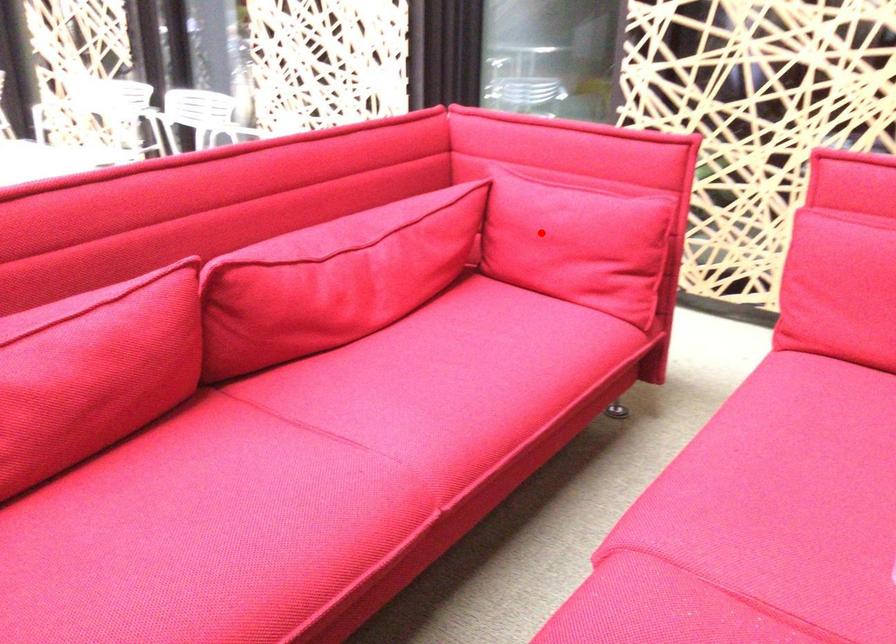
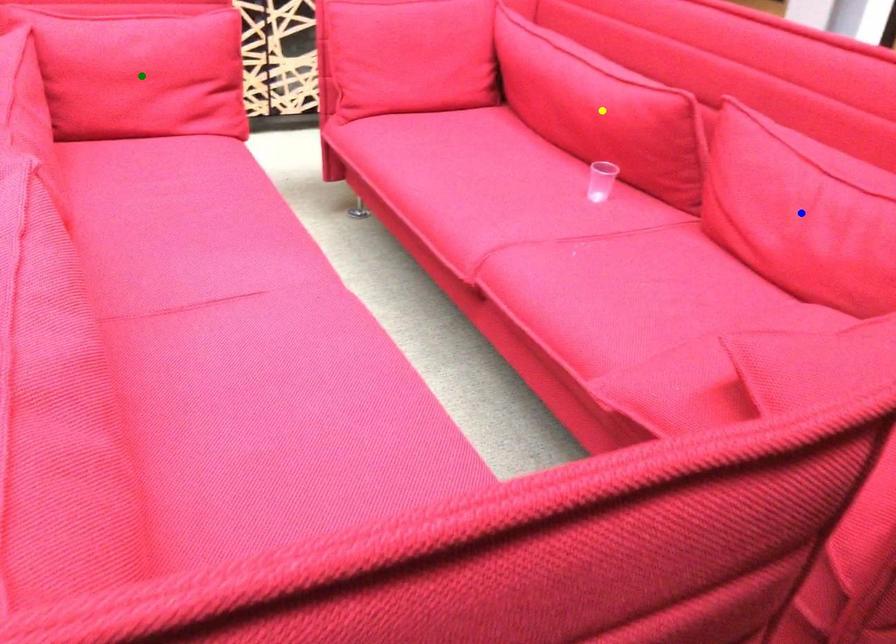
Question: I am providing you with two images of the same scene from different viewpoints. A red point is marked on the first image. You are given multiple points on the second image. Which mark in image 2 goes with the point in image 1?

Choices:
 (A) yellow point
 (B) blue point
 (C) green point

Answer: (C)